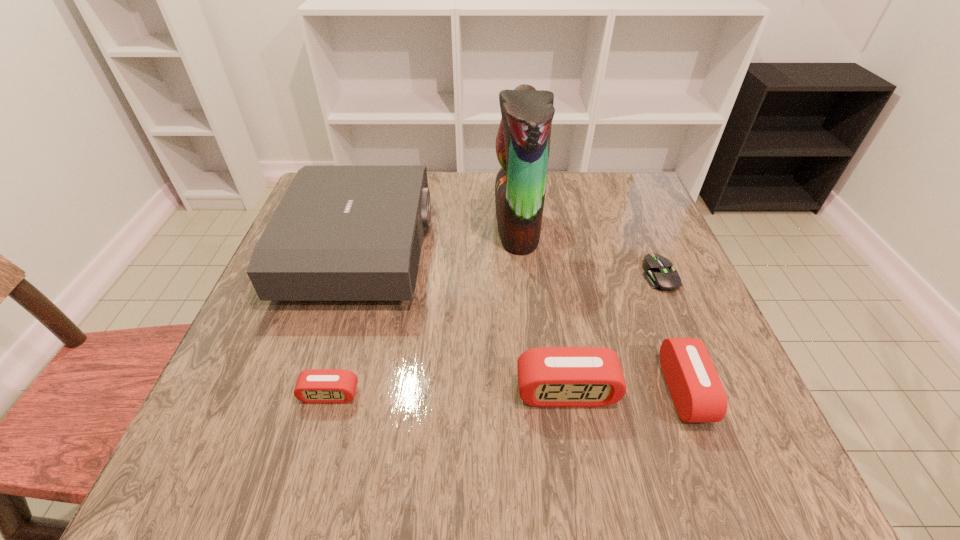
Please mark a free spot for a new alarm_clock to balance the arrangement. Please provide its 2D coordinates. Your answer should be formatted as a tuple, i.e. [(x, y)], where the tuple contains the x and y coordinates of a point satisfying the conditions above.

[(448, 393)]